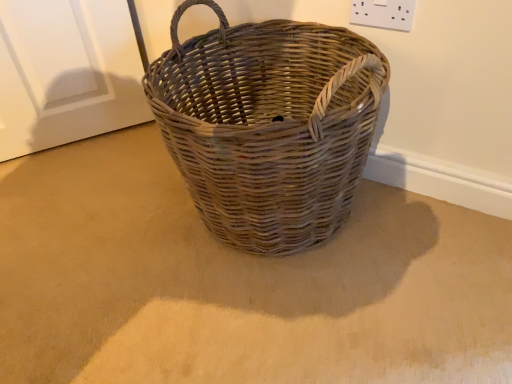
Question: From the image's perspective, is white plastic socket at upper right located beneath natural woven picnic basket at center?

Choices:
 (A) no
 (B) yes

Answer: (A)

Question: Could you tell me if white plastic socket at upper right is turned towards natural woven picnic basket at center?

Choices:
 (A) no
 (B) yes

Answer: (B)

Question: Does white plastic socket at upper right have a lesser height compared to natural woven picnic basket at center?

Choices:
 (A) no
 (B) yes

Answer: (B)

Question: Is white plastic socket at upper right positioned beyond the bounds of natural woven picnic basket at center?

Choices:
 (A) yes
 (B) no

Answer: (A)

Question: Are white plastic socket at upper right and natural woven picnic basket at center far apart?

Choices:
 (A) no
 (B) yes

Answer: (A)

Question: Is white plastic socket at upper right further to the viewer compared to natural woven picnic basket at center?

Choices:
 (A) no
 (B) yes

Answer: (B)

Question: Could you tell me if natural woven picnic basket at center is facing white plastic socket at upper right?

Choices:
 (A) no
 (B) yes

Answer: (A)

Question: Is natural woven picnic basket at center shorter than white plastic socket at upper right?

Choices:
 (A) no
 (B) yes

Answer: (A)

Question: Is natural woven picnic basket at center smaller than white plastic socket at upper right?

Choices:
 (A) yes
 (B) no

Answer: (B)

Question: From the image's perspective, does natural woven picnic basket at center appear lower than white plastic socket at upper right?

Choices:
 (A) yes
 (B) no

Answer: (A)

Question: Does natural woven picnic basket at center have a lesser width compared to white plastic socket at upper right?

Choices:
 (A) no
 (B) yes

Answer: (A)

Question: Is the depth of natural woven picnic basket at center less than that of white plastic socket at upper right?

Choices:
 (A) no
 (B) yes

Answer: (B)

Question: In terms of height, does white plastic socket at upper right look taller or shorter compared to natural woven picnic basket at center?

Choices:
 (A) tall
 (B) short

Answer: (B)